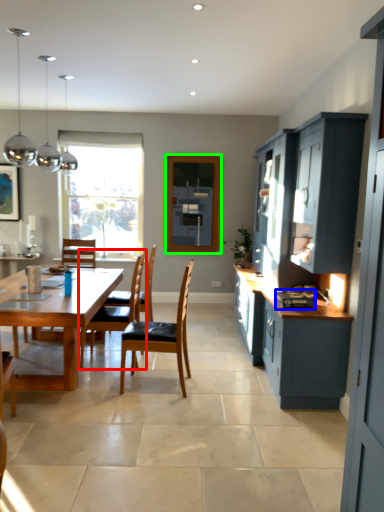
Question: Which object is the farthest from chair (highlighted by a red box)? Choose among these: appliance (highlighted by a blue box) or window screen (highlighted by a green box).

Choices:
 (A) appliance
 (B) window screen

Answer: (B)